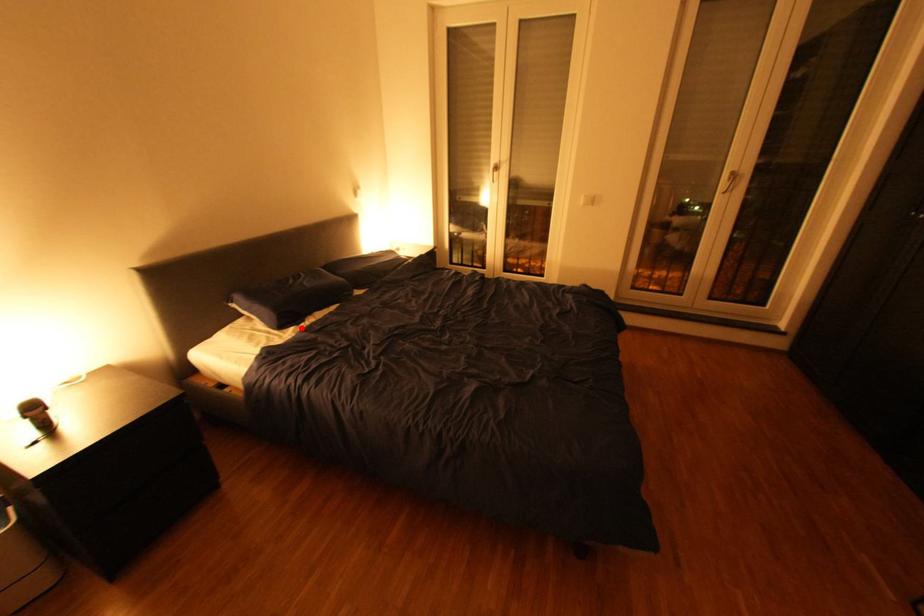
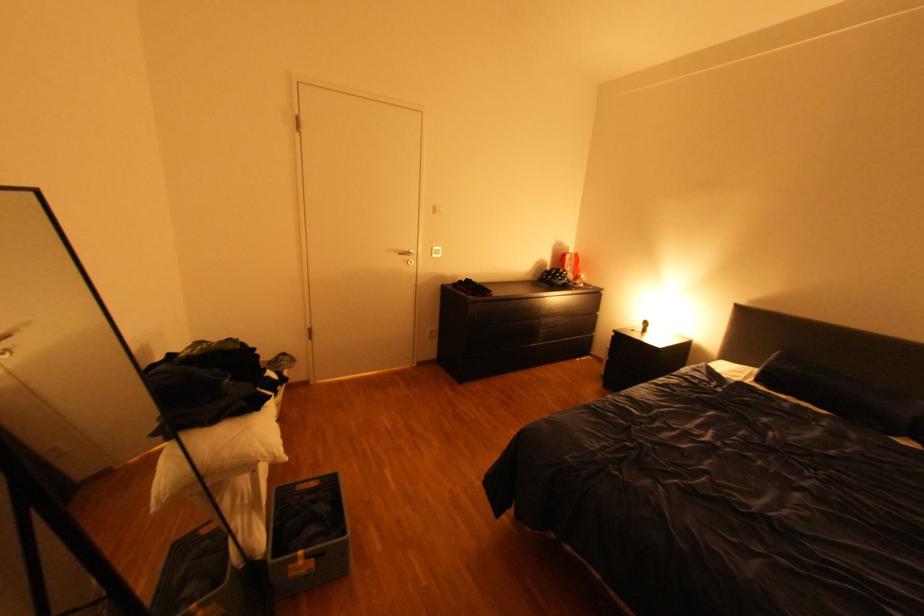
Locate, in the second image, the point that corresponds to the highlighted location in the first image.

(771, 387)